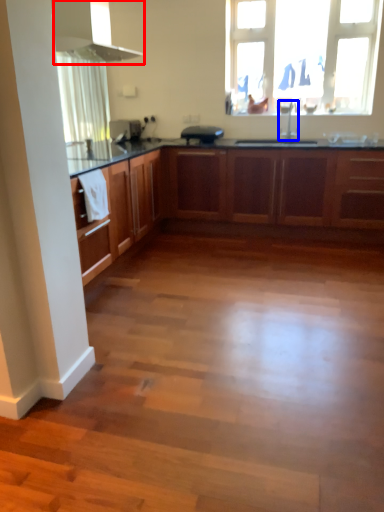
Question: Which point is further to the camera, exhaust hood (highlighted by a red box) or tap (highlighted by a blue box)?

Choices:
 (A) exhaust hood
 (B) tap

Answer: (B)